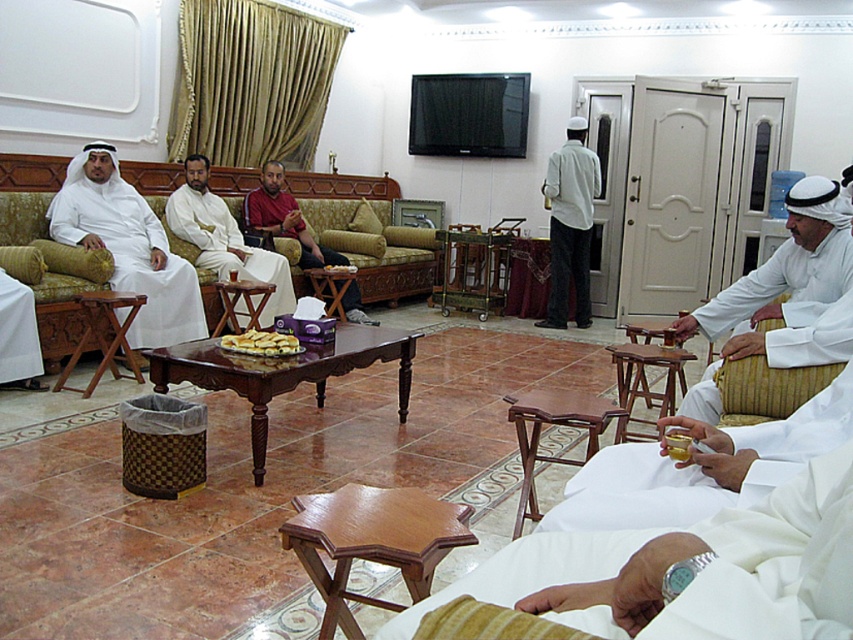
You are a guest at this gathering and want to place a small decorative item on the higher object between the light gray cotton shirt at center and the wooden stool at center. Which object should you choose?

The light gray cotton shirt at center is taller than the wooden stool at center, so you should place the decorative item on the light gray cotton shirt at center.

You are a photographer standing in the room and want to take a closeup photo of the white woven drum at right. The camera you are using has a minimum focusing distance of 2 meters. Can you take the photo without moving closer?

The white woven drum at right is 2.41 meters away from the camera. Since the minimum focusing distance is 2 meters, the camera can focus on the white woven drum at right from this distance, so yes, you can take the photo without moving closer.